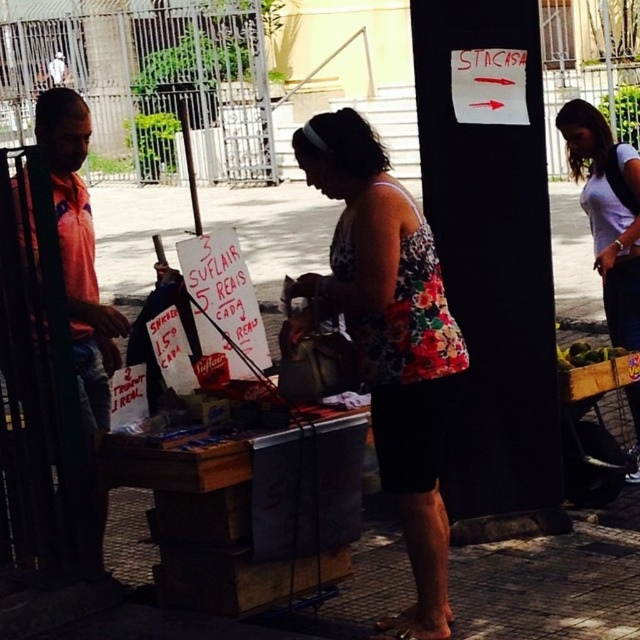
You are standing at the entrance of the outdoor market and see the floral fabric dress at center. If you walk straight ahead, will you pass by the vendor stall first before reaching the dress?

The floral fabric dress at center is located at point (388, 339), which is closer to the entrance than the vendor stall. Therefore, you would reach the dress before passing the vendor stall.

You are a customer at the market and want to pick up the green leafy vegetables at lower right. However, the white cotton shirt at right is blocking your view. Can you reach the vegetables without moving the shirt?

The green leafy vegetables at lower right is behind the white cotton shirt at right, so you can reach them without moving the shirt as they are positioned behind it.

You are a customer at the market and want to pick up both the floral fabric dress at center and the white cotton shirt at right. If you are standing at the center of the stall, which item is closer to you?

The floral fabric dress at center is closer to you since it is at the center, while the white cotton shirt at right is further away to the right side of the stall.